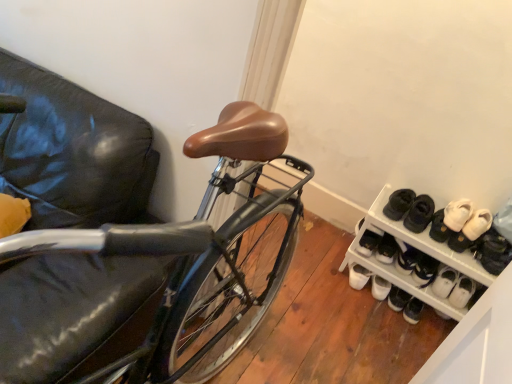
What do you see at coordinates (450, 220) in the screenshot?
I see `white suede shoes at right, which is counted as the 3th footwear, starting from the right` at bounding box center [450, 220].

The width and height of the screenshot is (512, 384). Describe the element at coordinates (471, 231) in the screenshot. I see `white suede sneakers at lower right, acting as the third footwear starting from the left` at that location.

Locate an element on the screen. This screenshot has width=512, height=384. white suede sneakers at lower right, which ranks as the 4th footwear in left-to-right order is located at coordinates (493, 252).

The height and width of the screenshot is (384, 512). What do you see at coordinates (368, 243) in the screenshot? I see `white suede sneakers at lower right, the first footwear in the left-to-right sequence` at bounding box center [368, 243].

Locate an element on the screen. The image size is (512, 384). white suede sneakers at lower right, the first footwear in the left-to-right sequence is located at coordinates pyautogui.click(x=368, y=243).

Find the location of a particular element. Image resolution: width=512 pixels, height=384 pixels. white plastic shoe rack at lower right is located at coordinates (453, 309).

Between point (465, 241) and point (376, 265), which one is positioned in front?

The point (465, 241) is more forward.

Which is correct: white suede sneakers at lower right, the second footwear viewed from the right, is inside white plastic shoe rack at lower right, or outside of it?

white suede sneakers at lower right, the second footwear viewed from the right, exists outside the volume of white plastic shoe rack at lower right.

Is white suede sneakers at lower right, the second footwear viewed from the right, behind white plastic shoe rack at lower right?

Yes, it is behind white plastic shoe rack at lower right.

Would you consider white suede sneakers at lower right, acting as the third footwear starting from the left, to be distant from white plastic shoe rack at lower right?

No, white suede sneakers at lower right, acting as the third footwear starting from the left, is in close proximity to white plastic shoe rack at lower right.

Can white suede sneakers at lower right, positioned as the 1th footwear in right-to-left order, be found inside white suede sneakers at lower right, which appears as the fourth footwear when viewed from the right?

Actually, white suede sneakers at lower right, positioned as the 1th footwear in right-to-left order, is outside white suede sneakers at lower right, which appears as the fourth footwear when viewed from the right.

From the image's perspective, is white suede sneakers at lower right, the first footwear in the left-to-right sequence, over white suede sneakers at lower right, which ranks as the 4th footwear in left-to-right order?

Yes, from the image's perspective, white suede sneakers at lower right, the first footwear in the left-to-right sequence, is above white suede sneakers at lower right, which ranks as the 4th footwear in left-to-right order.

Can you see white suede sneakers at lower right, the first footwear in the left-to-right sequence, touching white suede sneakers at lower right, positioned as the 1th footwear in right-to-left order?

No, white suede sneakers at lower right, the first footwear in the left-to-right sequence, is not beside white suede sneakers at lower right, positioned as the 1th footwear in right-to-left order.

Which is in front, point (378, 241) or point (492, 243)?

The point (492, 243) is closer.

From a real-world perspective, is white suede shoes at right, which ranks as the 2th footwear in left-to-right order, positioned over white plastic shoe rack at lower right based on gravity?

Indeed, from a real-world perspective, white suede shoes at right, which ranks as the 2th footwear in left-to-right order, stands above white plastic shoe rack at lower right.

From the image's perspective, is white suede shoes at right, which is counted as the 3th footwear, starting from the right, beneath white plastic shoe rack at lower right?

No.

Based on the photo, looking at the image, does white suede shoes at right, which ranks as the 2th footwear in left-to-right order, seem bigger or smaller compared to white plastic shoe rack at lower right?

Clearly, white suede shoes at right, which ranks as the 2th footwear in left-to-right order, is smaller in size than white plastic shoe rack at lower right.

Is white suede shoes at right, which is counted as the 3th footwear, starting from the right, to the left of white plastic shoe rack at lower right from the viewer's perspective?

Incorrect, white suede shoes at right, which is counted as the 3th footwear, starting from the right, is not on the left side of white plastic shoe rack at lower right.

Is point (373, 220) positioned in front of point (456, 226)?

No, (373, 220) is behind (456, 226).

Consider the image. Can you confirm if white plastic shoe rack at lower right is smaller than white suede shoes at right, which is counted as the 3th footwear, starting from the right?

Actually, white plastic shoe rack at lower right might be larger than white suede shoes at right, which is counted as the 3th footwear, starting from the right.

How different are the orientations of white plastic shoe rack at lower right and white suede shoes at right, which ranks as the 2th footwear in left-to-right order, in degrees?

They differ by 1.67 degrees in their facing directions.

Considering the sizes of white plastic shoe rack at lower right and white suede shoes at right, which ranks as the 2th footwear in left-to-right order, in the image, is white plastic shoe rack at lower right taller or shorter than white suede shoes at right, which ranks as the 2th footwear in left-to-right order,?

Considering their sizes, white plastic shoe rack at lower right has more height than white suede shoes at right, which ranks as the 2th footwear in left-to-right order.

Between white suede shoes at right, which is counted as the 3th footwear, starting from the right, and white suede sneakers at lower right, which appears as the fourth footwear when viewed from the right, which one is positioned in front?

white suede shoes at right, which is counted as the 3th footwear, starting from the right.

From the image's perspective, relative to white suede sneakers at lower right, the first footwear in the left-to-right sequence, is white suede shoes at right, which ranks as the 2th footwear in left-to-right order, above or below?

white suede shoes at right, which ranks as the 2th footwear in left-to-right order, is situated higher than white suede sneakers at lower right, the first footwear in the left-to-right sequence, in the image.

Does white suede shoes at right, which is counted as the 3th footwear, starting from the right, have a greater width compared to white suede sneakers at lower right, the first footwear in the left-to-right sequence?

Yes, white suede shoes at right, which is counted as the 3th footwear, starting from the right, is wider than white suede sneakers at lower right, the first footwear in the left-to-right sequence.

Would you say white plastic shoe rack at lower right is inside or outside white suede sneakers at lower right, positioned as the 1th footwear in right-to-left order?

white plastic shoe rack at lower right is outside white suede sneakers at lower right, positioned as the 1th footwear in right-to-left order.

From a real-world perspective, which object stands above the other?

white suede sneakers at lower right, which ranks as the 4th footwear in left-to-right order, is physically above.

Is white plastic shoe rack at lower right positioned with its back to white suede sneakers at lower right, which ranks as the 4th footwear in left-to-right order?

That's not correct — white plastic shoe rack at lower right is not looking away from white suede sneakers at lower right, which ranks as the 4th footwear in left-to-right order.

Is white plastic shoe rack at lower right positioned far away from white suede sneakers at lower right, positioned as the 1th footwear in right-to-left order?

No, white plastic shoe rack at lower right is not far away from white suede sneakers at lower right, positioned as the 1th footwear in right-to-left order.

From a real-world perspective, relative to white suede sneakers at lower right, which ranks as the 4th footwear in left-to-right order, is white suede sneakers at lower right, acting as the third footwear starting from the left, vertically above or below?

white suede sneakers at lower right, acting as the third footwear starting from the left, is below white suede sneakers at lower right, which ranks as the 4th footwear in left-to-right order.

Is white suede sneakers at lower right, the second footwear viewed from the right, oriented away from white suede sneakers at lower right, which ranks as the 4th footwear in left-to-right order?

No.

Between white suede sneakers at lower right, the second footwear viewed from the right, and white suede sneakers at lower right, positioned as the 1th footwear in right-to-left order, which one has smaller width?

Thinner between the two is white suede sneakers at lower right, positioned as the 1th footwear in right-to-left order.

From the image's perspective, which is above, white suede sneakers at lower right, acting as the third footwear starting from the left, or white suede sneakers at lower right, which ranks as the 4th footwear in left-to-right order?

white suede sneakers at lower right, acting as the third footwear starting from the left, from the image's perspective.

This screenshot has height=384, width=512. I want to click on cabinetry below the white suede sneakers at lower right, the second footwear viewed from the right (from a real-world perspective), so click(453, 309).

Which footwear is the 3rd one when counting from the left side of the white suede sneakers at lower right, which ranks as the 4th footwear in left-to-right order? Please provide its 2D coordinates.

[(368, 243)]

Estimate the real-world distances between objects in this image. Which object is further from white suede shoes at right, which ranks as the 2th footwear in left-to-right order, white plastic shoe rack at lower right or white suede sneakers at lower right, positioned as the 1th footwear in right-to-left order?

Based on the image, white plastic shoe rack at lower right appears to be further to white suede shoes at right, which ranks as the 2th footwear in left-to-right order.

From the image, which object appears to be nearer to white suede sneakers at lower right, positioned as the 1th footwear in right-to-left order, white suede sneakers at lower right, acting as the third footwear starting from the left, or white plastic shoe rack at lower right?

The object closer to white suede sneakers at lower right, positioned as the 1th footwear in right-to-left order, is white suede sneakers at lower right, acting as the third footwear starting from the left.

Estimate the real-world distances between objects in this image. Which object is closer to white plastic shoe rack at lower right, white suede sneakers at lower right, which appears as the fourth footwear when viewed from the right, or white suede sneakers at lower right, which ranks as the 4th footwear in left-to-right order?

Based on the image, white suede sneakers at lower right, which appears as the fourth footwear when viewed from the right, appears to be nearer to white plastic shoe rack at lower right.

Looking at the image, which one is located further to white suede sneakers at lower right, which ranks as the 4th footwear in left-to-right order, white plastic shoe rack at lower right or white suede sneakers at lower right, which appears as the fourth footwear when viewed from the right?

white suede sneakers at lower right, which appears as the fourth footwear when viewed from the right, is further to white suede sneakers at lower right, which ranks as the 4th footwear in left-to-right order.

From the image, which object appears to be farther from white suede sneakers at lower right, the second footwear viewed from the right, white suede sneakers at lower right, the first footwear in the left-to-right sequence, or white suede sneakers at lower right, which ranks as the 4th footwear in left-to-right order?

The object further to white suede sneakers at lower right, the second footwear viewed from the right, is white suede sneakers at lower right, the first footwear in the left-to-right sequence.

From the image, which object appears to be nearer to white suede shoes at right, which is counted as the 3th footwear, starting from the right, white suede sneakers at lower right, which ranks as the 4th footwear in left-to-right order, or white suede sneakers at lower right, acting as the third footwear starting from the left?

Among the two, white suede sneakers at lower right, acting as the third footwear starting from the left, is located nearer to white suede shoes at right, which is counted as the 3th footwear, starting from the right.

Which object lies nearer to the anchor point white suede sneakers at lower right, the first footwear in the left-to-right sequence, white suede sneakers at lower right, acting as the third footwear starting from the left, or white suede sneakers at lower right, which ranks as the 4th footwear in left-to-right order?

The object closer to white suede sneakers at lower right, the first footwear in the left-to-right sequence, is white suede sneakers at lower right, acting as the third footwear starting from the left.

From the image, which object appears to be farther from white suede sneakers at lower right, which appears as the fourth footwear when viewed from the right, white suede sneakers at lower right, positioned as the 1th footwear in right-to-left order, or white suede shoes at right, which ranks as the 2th footwear in left-to-right order?

The object further to white suede sneakers at lower right, which appears as the fourth footwear when viewed from the right, is white suede sneakers at lower right, positioned as the 1th footwear in right-to-left order.

At what (x,y) coordinates should I click in order to perform the action: click on footwear between white suede sneakers at lower right, the first footwear in the left-to-right sequence, and white suede sneakers at lower right, acting as the third footwear starting from the left, from left to right. Please return your answer as a coordinate pair (x, y). The height and width of the screenshot is (384, 512). Looking at the image, I should click on (450, 220).

Locate an element on the screen. This screenshot has height=384, width=512. footwear located between white suede shoes at right, which is counted as the 3th footwear, starting from the right, and white suede sneakers at lower right, which ranks as the 4th footwear in left-to-right order, in the left-right direction is located at coordinates (471, 231).

Identify the location of cabinetry between white suede sneakers at lower right, the first footwear in the left-to-right sequence, and white suede sneakers at lower right, the second footwear viewed from the right, in the horizontal direction. (453, 309).

Locate an element on the screen. cabinetry between white suede sneakers at lower right, the first footwear in the left-to-right sequence, and white suede sneakers at lower right, positioned as the 1th footwear in right-to-left order is located at coordinates (453, 309).